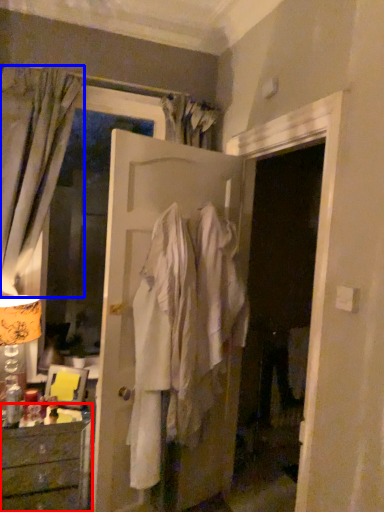
Question: Among these objects, which one is farthest to the camera, chest of drawers (highlighted by a red box) or curtain (highlighted by a blue box)?

Choices:
 (A) chest of drawers
 (B) curtain

Answer: (B)